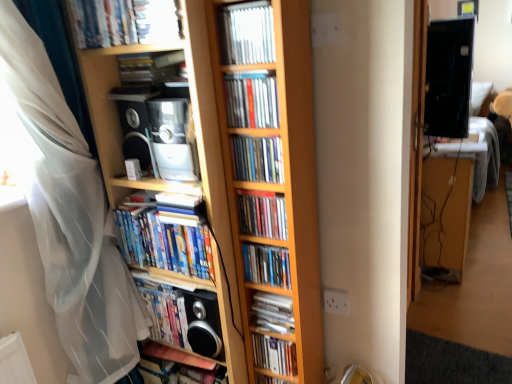
Question: Is hardcover book at lower left, the 11th book when ordered from top to bottom, wider than wooden desk at right?

Choices:
 (A) yes
 (B) no

Answer: (B)

Question: Is hardcover book at lower left, the 11th book when ordered from top to bottom, directly adjacent to wooden desk at right?

Choices:
 (A) no
 (B) yes

Answer: (A)

Question: From a real-world perspective, is hardcover book at lower left, placed as the 1th book when sorted from bottom to top, physically above wooden desk at right?

Choices:
 (A) no
 (B) yes

Answer: (A)

Question: Is hardcover book at lower left, the 11th book when ordered from top to bottom, at the left side of wooden desk at right?

Choices:
 (A) no
 (B) yes

Answer: (B)

Question: Is hardcover book at lower left, placed as the 1th book when sorted from bottom to top, thinner than wooden desk at right?

Choices:
 (A) no
 (B) yes

Answer: (B)

Question: Is hardcover book at lower left, placed as the 1th book when sorted from bottom to top, positioned beyond the bounds of wooden desk at right?

Choices:
 (A) no
 (B) yes

Answer: (B)

Question: Is black glossy monitor at upper right closer to the viewer compared to matte plastic book at center, marked as the third book in a top-to-bottom arrangement?

Choices:
 (A) yes
 (B) no

Answer: (B)

Question: Does black glossy monitor at upper right appear on the right side of matte plastic book at center, which appears as the ninth book when ordered from the bottom?

Choices:
 (A) no
 (B) yes

Answer: (B)

Question: From a real-world perspective, is black glossy monitor at upper right physically above matte plastic book at center, which appears as the ninth book when ordered from the bottom?

Choices:
 (A) yes
 (B) no

Answer: (B)

Question: Is black glossy monitor at upper right located outside matte plastic book at center, marked as the third book in a top-to-bottom arrangement?

Choices:
 (A) yes
 (B) no

Answer: (A)

Question: Is matte plastic book at center, marked as the third book in a top-to-bottom arrangement, at the back of black glossy monitor at upper right?

Choices:
 (A) no
 (B) yes

Answer: (B)

Question: Considering the relative sizes of black glossy monitor at upper right and matte plastic book at center, which appears as the ninth book when ordered from the bottom, in the image provided, is black glossy monitor at upper right wider than matte plastic book at center, which appears as the ninth book when ordered from the bottom,?

Choices:
 (A) yes
 (B) no

Answer: (A)

Question: Does metallic silver cd at center, the 10th book in the bottom-to-top sequence, have a larger size compared to hardcover books at center, the 6th book positioned from the top?

Choices:
 (A) no
 (B) yes

Answer: (A)